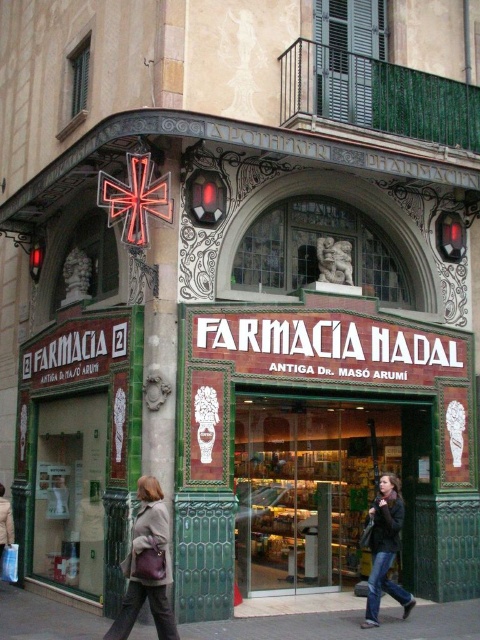
Between concrete pavement at lower center and leather jacket at lower center, which one appears on the left side from the viewer's perspective?

leather jacket at lower center

The height and width of the screenshot is (640, 480). Find the location of `concrete pavement at lower center`. concrete pavement at lower center is located at coordinates (348, 625).

Locate an element on the screen. The width and height of the screenshot is (480, 640). concrete pavement at lower center is located at coordinates (348, 625).

Is leather jacket at lower center shorter than dark brown leather jacket at lower right?

Incorrect, leather jacket at lower center's height does not fall short of dark brown leather jacket at lower right's.

Locate an element on the screen. The height and width of the screenshot is (640, 480). leather jacket at lower center is located at coordinates (143, 577).

At what (x,y) coordinates should I click in order to perform the action: click on concrete pavement at lower center. Please return your answer as a coordinate pair (x, y). This screenshot has width=480, height=640. Looking at the image, I should click on (348, 625).

Who is higher up, concrete pavement at lower center or dark brown leather jacket at lower right?

dark brown leather jacket at lower right

Image resolution: width=480 pixels, height=640 pixels. What do you see at coordinates (348, 625) in the screenshot?
I see `concrete pavement at lower center` at bounding box center [348, 625].

Where is `concrete pavement at lower center`? The height and width of the screenshot is (640, 480). concrete pavement at lower center is located at coordinates (348, 625).